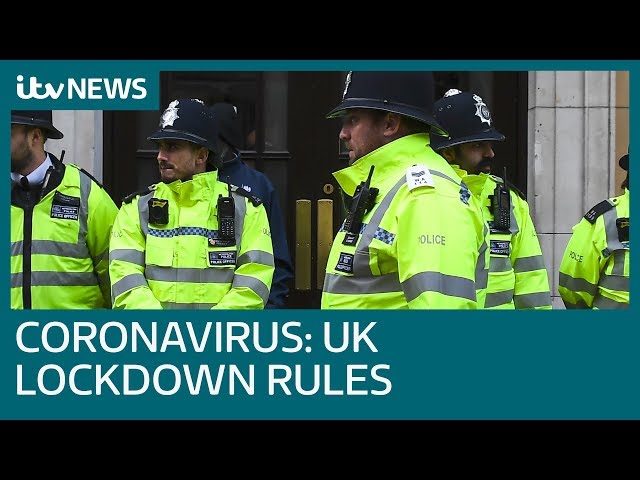
Identify the location of left gold handle plate. (301, 249).